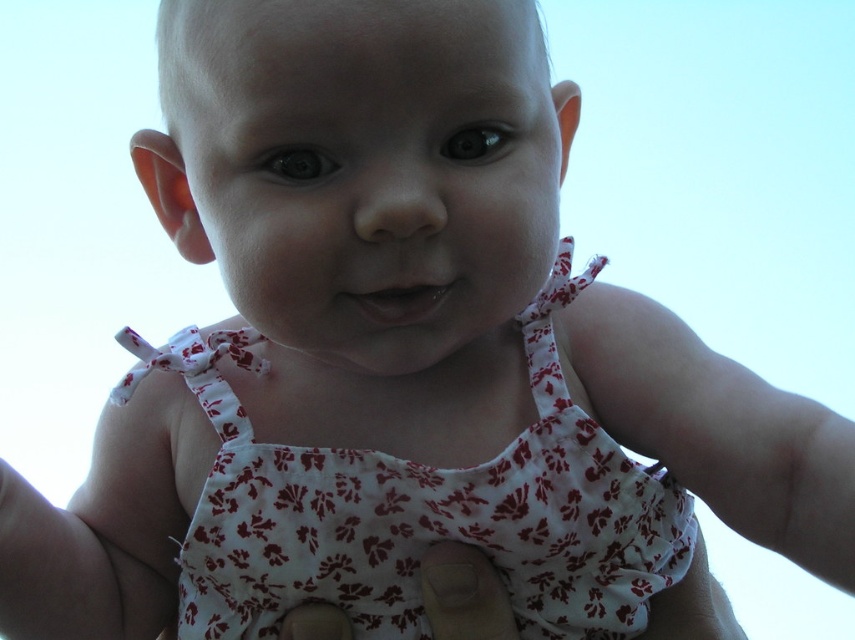
Looking at the baby in the light, you notice two items of clothing on them. Which one is bigger, the white floral fabric dress at center or the white fabric diaper at center?

The white floral fabric dress at center is larger than the white fabric diaper at center.

You are a photographer adjusting the focus on your camera. You want to capture the white floral fabric dress at center and the white fabric diaper at center clearly. Since both are at the center, which one should you focus on first to ensure it appears sharp in the photo?

You should focus on the white floral fabric dress at center first because it is closer to the viewer than the white fabric diaper at center, so adjusting focus starting from the closer object ensures both will be in focus.

You are a photographer trying to capture the baby in the image. You want to focus on the white fabric diaper at center while ensuring the white floral fabric dress at center is still visible in the frame. Based on their positions, which side of the diaper should you position the dress to maintain visibility?

The white floral fabric dress at center is to the right of the white fabric diaper at center, so positioning the dress to the right side of the diaper will keep it visible in the frame.